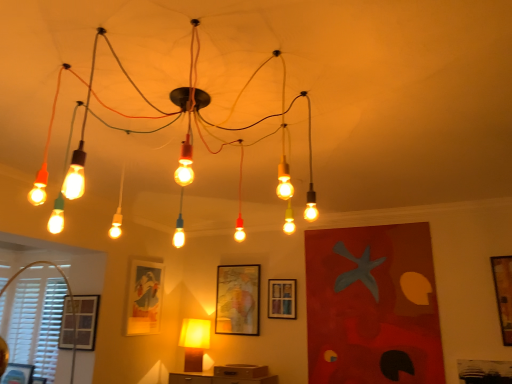
Question: Is wooden picture frame at right, which ranks as the 1th picture frame in right-to-left order, at the right side of matte glass picture frame at center left, arranged as the third picture frame when viewed from the left?

Choices:
 (A) no
 (B) yes

Answer: (B)

Question: Is wooden picture frame at right, which ranks as the 1th picture frame in right-to-left order, turned away from matte glass picture frame at center left, which appears as the fourth picture frame when viewed from the right?

Choices:
 (A) no
 (B) yes

Answer: (A)

Question: Can you confirm if wooden picture frame at right, which ranks as the 1th picture frame in right-to-left order, is taller than matte glass picture frame at center left, which appears as the fourth picture frame when viewed from the right?

Choices:
 (A) yes
 (B) no

Answer: (A)

Question: Is the position of wooden picture frame at right, which is counted as the sixth picture frame, starting from the left, less distant than that of matte glass picture frame at center left, arranged as the third picture frame when viewed from the left?

Choices:
 (A) yes
 (B) no

Answer: (A)

Question: Can you confirm if wooden picture frame at right, which is counted as the sixth picture frame, starting from the left, is wider than matte glass picture frame at center left, which appears as the fourth picture frame when viewed from the right?

Choices:
 (A) yes
 (B) no

Answer: (A)

Question: From the image's perspective, does wooden picture frame at right, which is counted as the sixth picture frame, starting from the left, appear lower than matte glass picture frame at center left, which appears as the fourth picture frame when viewed from the right?

Choices:
 (A) no
 (B) yes

Answer: (A)

Question: From the image's perspective, is matte black picture frame at lower left, placed as the 2th picture frame when sorted from left to right, on top of matte glass light fixture at center, the first lamp when ordered from top to bottom?

Choices:
 (A) yes
 (B) no

Answer: (B)

Question: Is matte black picture frame at lower left, placed as the 2th picture frame when sorted from left to right, positioned far away from matte glass light fixture at center, the 1th lamp viewed from the front?

Choices:
 (A) no
 (B) yes

Answer: (B)

Question: Can you confirm if matte black picture frame at lower left, the 5th picture frame positioned from the right, is wider than matte glass light fixture at center, the 1th lamp viewed from the front?

Choices:
 (A) no
 (B) yes

Answer: (A)

Question: From a real-world perspective, is matte black picture frame at lower left, placed as the 2th picture frame when sorted from left to right, positioned under matte glass light fixture at center, the second lamp when ordered from bottom to top, based on gravity?

Choices:
 (A) yes
 (B) no

Answer: (A)

Question: From the image's perspective, is matte black picture frame at lower left, placed as the 2th picture frame when sorted from left to right, beneath matte glass light fixture at center, which is the second lamp in back-to-front order?

Choices:
 (A) no
 (B) yes

Answer: (B)

Question: Can you confirm if matte black picture frame at lower left, the 5th picture frame positioned from the right, is thinner than matte glass light fixture at center, the first lamp when ordered from top to bottom?

Choices:
 (A) no
 (B) yes

Answer: (B)

Question: Is matte glass light fixture at center, the 1th lamp viewed from the front, not near matte glass picture frame at center left, which appears as the fourth picture frame when viewed from the right?

Choices:
 (A) no
 (B) yes

Answer: (B)